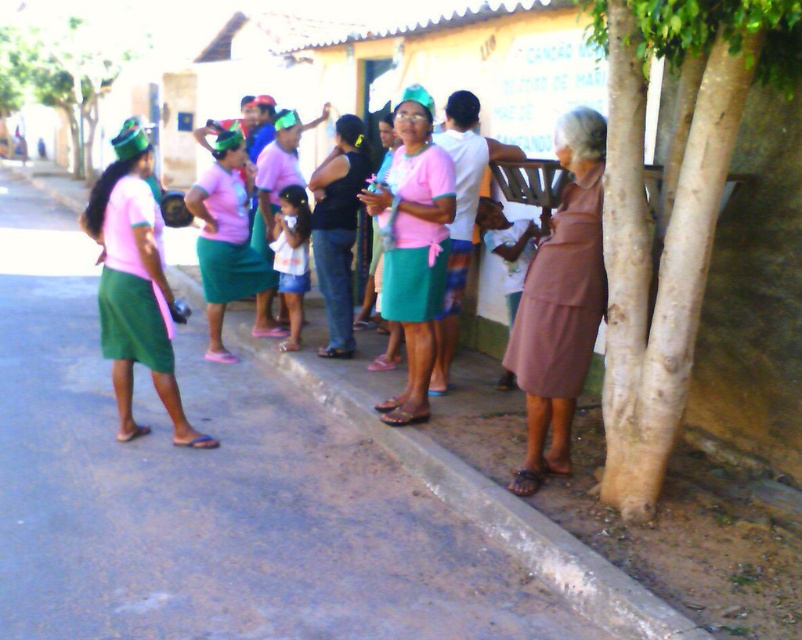
You are a photographer trying to capture a group photo of the people in the scene. You notice the brown fabric dress at lower right and the matte pink shirt at left. Since you want to ensure that the clothing details are visible in the photo, which clothing item should you focus on to avoid blurriness due to its size?

The brown fabric dress at lower right is thinner than the matte pink shirt at left, so focusing on the matte pink shirt at left would be better to avoid blurriness because it has a larger size.